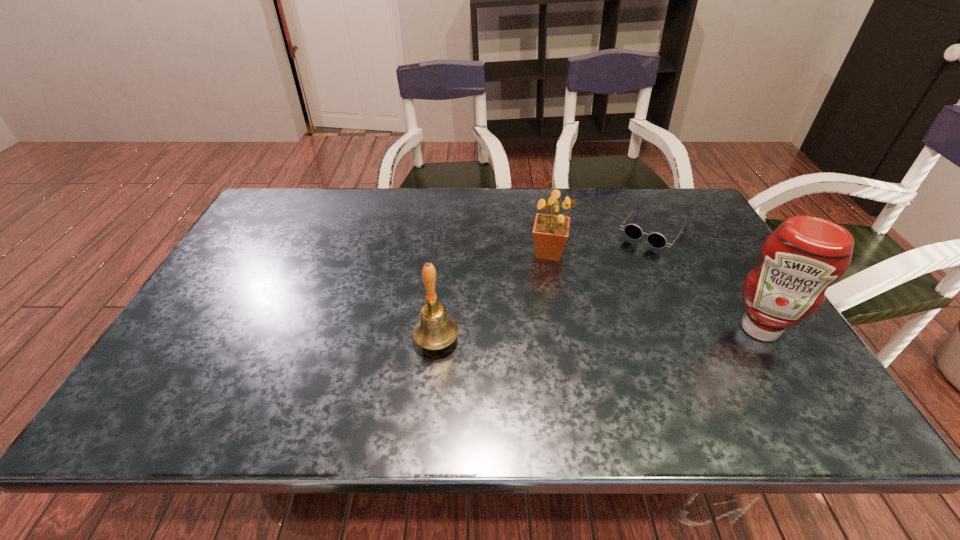
Image resolution: width=960 pixels, height=540 pixels. Identify the location of vacant region between the condiment and the bell. (598, 334).

This screenshot has height=540, width=960. Identify the location of unoccupied position between the sunflower and the sunglasses. (601, 242).

Identify the location of the third closest object to the second object from left to right. (799, 260).

Identify which object is located as the nearest to the sunflower. Please provide its 2D coordinates. Your answer should be formatted as a tuple, i.e. [(x, y)], where the tuple contains the x and y coordinates of a point satisfying the conditions above.

[(657, 240)]

Image resolution: width=960 pixels, height=540 pixels. What are the coordinates of `free region that satisfies the following two spatial constraints: 1. on the back side of the shortest object; 2. on the right side of the sunflower` in the screenshot? It's located at (546, 231).

Where is `free space that satisfies the following two spatial constraints: 1. on the front side of the sunglasses; 2. on the right side of the tallest object`? Image resolution: width=960 pixels, height=540 pixels. free space that satisfies the following two spatial constraints: 1. on the front side of the sunglasses; 2. on the right side of the tallest object is located at coordinates (701, 329).

Identify the location of vacant point that satisfies the following two spatial constraints: 1. on the back side of the sunglasses; 2. on the right side of the bell. This screenshot has width=960, height=540. (446, 231).